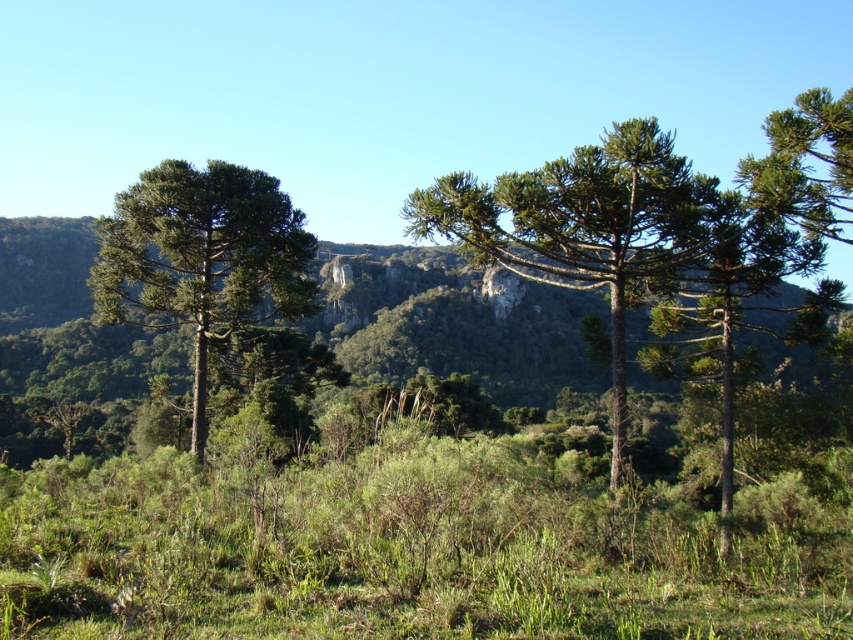
Question: Observing the image, what is the correct spatial positioning of green textured tree at center in reference to green textured pine tree at left?

Choices:
 (A) left
 (B) right

Answer: (B)

Question: Can you confirm if green textured tree at center is wider than green textured pine tree at left?

Choices:
 (A) no
 (B) yes

Answer: (A)

Question: Which point is closer to the camera taking this photo?

Choices:
 (A) (287, 205)
 (B) (567, 195)
 (C) (804, 340)

Answer: (B)

Question: Where is green textured pine tree at left located in relation to green needle-like foliage at center-right in the image?

Choices:
 (A) right
 (B) left

Answer: (B)

Question: Based on their relative distances, which object is farther from the green needle-like foliage at center-right?

Choices:
 (A) green textured tree at center
 (B) green textured pine tree at left

Answer: (B)

Question: Which point is closer to the camera?

Choices:
 (A) (248, 202)
 (B) (674, 205)

Answer: (B)